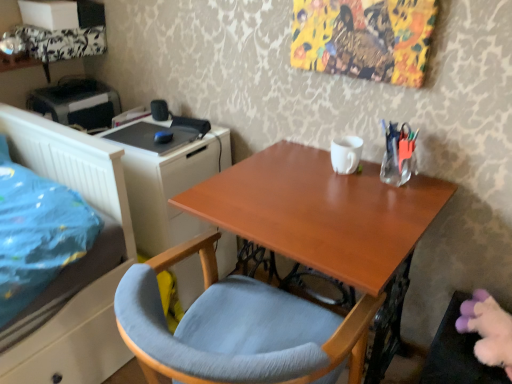
Question: Is light blue fabric chair at center positioned with its back to black plastic printer at upper left?

Choices:
 (A) no
 (B) yes

Answer: (A)

Question: Is black plastic printer at upper left located within light blue fabric chair at center?

Choices:
 (A) no
 (B) yes

Answer: (A)

Question: Is light blue fabric chair at center at the left side of black plastic printer at upper left?

Choices:
 (A) yes
 (B) no

Answer: (B)

Question: From a real-world perspective, is light blue fabric chair at center below black plastic printer at upper left?

Choices:
 (A) no
 (B) yes

Answer: (B)

Question: Does light blue fabric chair at center have a greater width compared to black plastic printer at upper left?

Choices:
 (A) no
 (B) yes

Answer: (B)

Question: From their relative heights in the image, would you say black plastic printer at upper left is taller or shorter than clear glass vase at upper right?

Choices:
 (A) short
 (B) tall

Answer: (B)

Question: Relative to clear glass vase at upper right, is black plastic printer at upper left in front or behind?

Choices:
 (A) behind
 (B) front

Answer: (A)

Question: From the image's perspective, is black plastic printer at upper left positioned above or below clear glass vase at upper right?

Choices:
 (A) above
 (B) below

Answer: (A)

Question: Considering the relative positions of black plastic printer at upper left and clear glass vase at upper right in the image provided, is black plastic printer at upper left to the left or to the right of clear glass vase at upper right?

Choices:
 (A) right
 (B) left

Answer: (B)

Question: Looking at their shapes, would you say wooden desk at center is wider or thinner than black plastic printer at upper left?

Choices:
 (A) wide
 (B) thin

Answer: (A)

Question: Is wooden desk at center taller or shorter than black plastic printer at upper left?

Choices:
 (A) tall
 (B) short

Answer: (A)

Question: From the image's perspective, is wooden desk at center located above or below black plastic printer at upper left?

Choices:
 (A) below
 (B) above

Answer: (A)

Question: From a real-world perspective, is wooden desk at center positioned above or below black plastic printer at upper left?

Choices:
 (A) above
 (B) below

Answer: (B)

Question: In the image, is clear glass vase at upper right positioned in front of or behind white matte file cabinet at left?

Choices:
 (A) front
 (B) behind

Answer: (A)

Question: From their relative heights in the image, would you say clear glass vase at upper right is taller or shorter than white matte file cabinet at left?

Choices:
 (A) short
 (B) tall

Answer: (A)